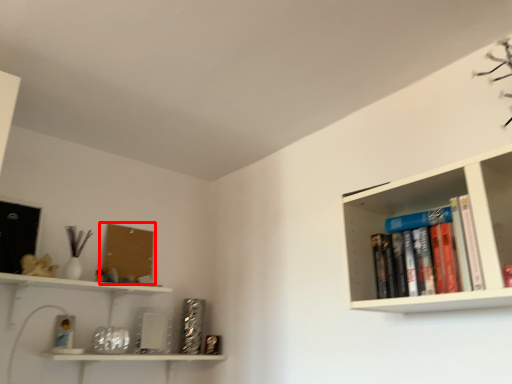
Question: From the image's perspective, what is the correct spatial positioning of book cover (annotated by the red box) in reference to book?

Choices:
 (A) above
 (B) below

Answer: (B)